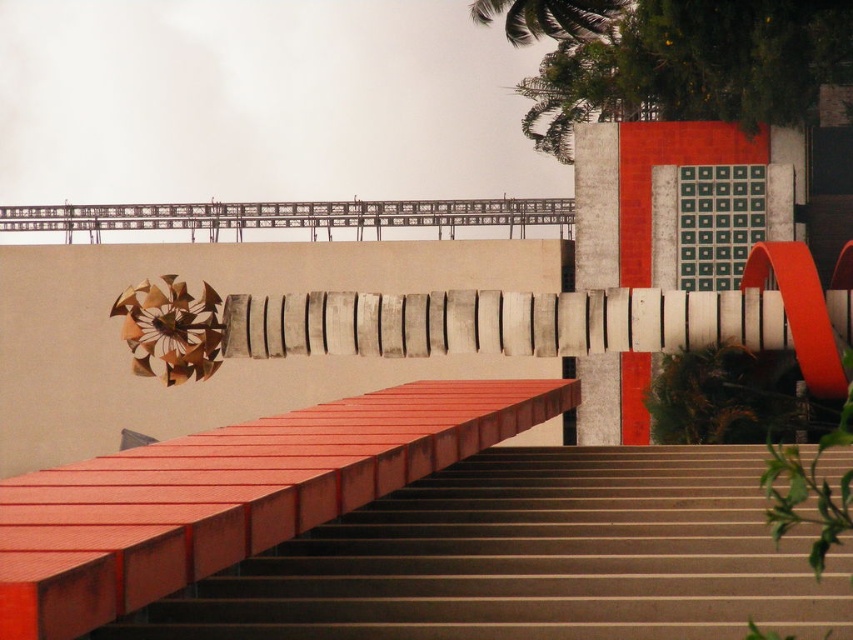
From the picture: Between metallic silver balustrade at upper center and green leafy palm tree at upper center, which one has less height?

Standing shorter between the two is metallic silver balustrade at upper center.

Does metallic silver balustrade at upper center have a greater height compared to green leafy palm tree at upper center?

Incorrect, metallic silver balustrade at upper center's height is not larger of green leafy palm tree at upper center's.

At what (x,y) coordinates should I click in order to perform the action: click on metallic silver balustrade at upper center. Please return your answer as a coordinate pair (x, y). Looking at the image, I should click on (289, 216).

The width and height of the screenshot is (853, 640). What are the coordinates of `metallic silver balustrade at upper center` in the screenshot? It's located at (289, 216).

What do you see at coordinates (532, 557) in the screenshot?
I see `brown concrete stairs at center` at bounding box center [532, 557].

Does point (622, 452) come closer to viewer compared to point (86, 209)?

Yes, it is in front of point (86, 209).

At what (x,y) coordinates should I click in order to perform the action: click on brown concrete stairs at center. Please return your answer as a coordinate pair (x, y). Looking at the image, I should click on pos(532,557).

Which is above, brown concrete stairs at center or green leafy palm tree at upper center?

green leafy palm tree at upper center is above.

Is brown concrete stairs at center closer to camera compared to green leafy palm tree at upper center?

Yes, brown concrete stairs at center is in front of green leafy palm tree at upper center.

The height and width of the screenshot is (640, 853). I want to click on brown concrete stairs at center, so click(532, 557).

You are a GUI agent. You are given a task and a screenshot of the screen. Output one action in this format:
    pyautogui.click(x=<x>, y=<y>)
    Task: Click on the brown concrete stairs at center
    
    Given the screenshot: What is the action you would take?
    pyautogui.click(x=532, y=557)